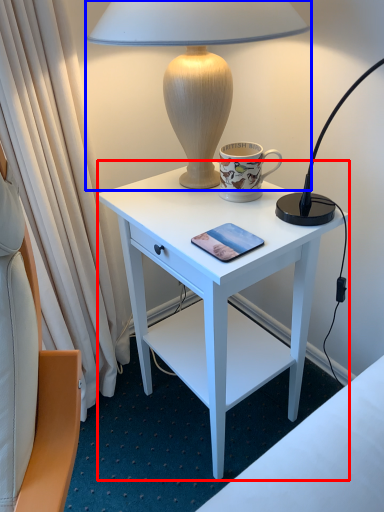
Question: Which of the following is the closest to the observer, desk (highlighted by a red box) or lamp (highlighted by a blue box)?

Choices:
 (A) desk
 (B) lamp

Answer: (B)